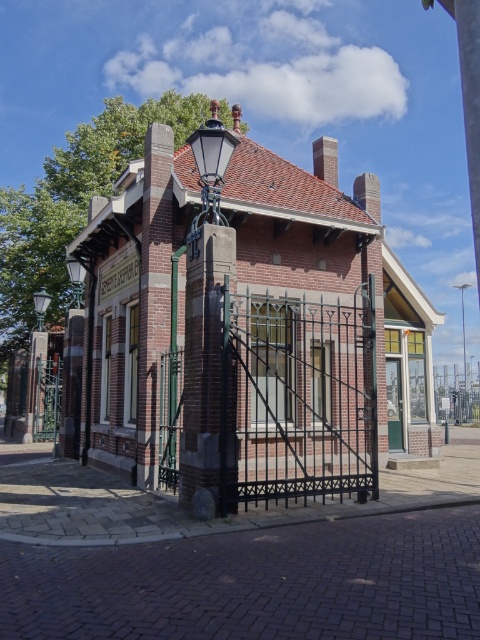
Question: Does brick pillar at center have a greater width compared to metallic silver streetlamp at center?

Choices:
 (A) no
 (B) yes

Answer: (A)

Question: Which of these objects is positioned farthest from the matte black lamp post at upper center?

Choices:
 (A) matte black lamp at left
 (B) brick pillar at center

Answer: (A)

Question: Which point is closer to the camera?

Choices:
 (A) brick pillar at center
 (B) matte black lamp at left
 (C) metallic silver streetlamp at center
 (D) matte black lamp post at upper center

Answer: (A)

Question: Which of the following is the farthest from the observer?

Choices:
 (A) (75, 301)
 (B) (465, 346)
 (C) (216, 200)
 (D) (204, 461)

Answer: (B)

Question: Can you confirm if brick pillar at center is positioned to the left of matte black lamp at left?

Choices:
 (A) no
 (B) yes

Answer: (A)

Question: Does matte black lamp post at upper center appear under matte black lamp at left?

Choices:
 (A) no
 (B) yes

Answer: (A)